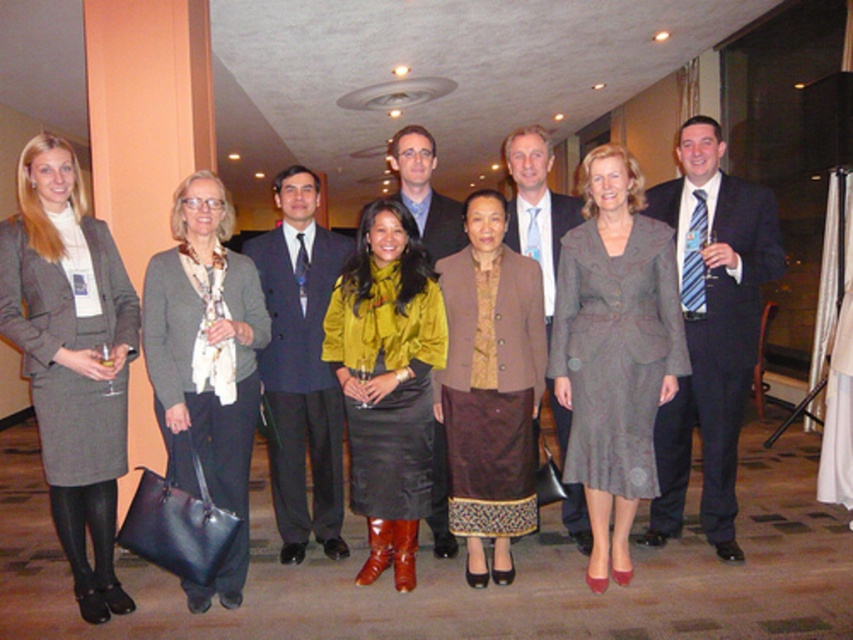
Question: Does matte black suit at center appear on the right side of velvet mustard blouse at center?

Choices:
 (A) no
 (B) yes

Answer: (B)

Question: Which object is closer to the camera taking this photo?

Choices:
 (A) satin blue suit at center
 (B) dark blue suit at center
 (C) matte gray suit at center
 (D) matte blue suit at center

Answer: (C)

Question: Does velvet mustard blouse at center lie behind dark blue suit at center?

Choices:
 (A) no
 (B) yes

Answer: (A)

Question: Which object appears farthest from the camera in this image?

Choices:
 (A) matte gray skirt at left
 (B) dark blue suit at center
 (C) matte blue suit at center
 (D) satin blue suit at center

Answer: (B)

Question: Which object is positioned farthest from the matte blue suit at center?

Choices:
 (A) matte black suit at center
 (B) dark blue suit at center

Answer: (B)

Question: Does matte gray suit at center lie behind satin blue suit at center?

Choices:
 (A) yes
 (B) no

Answer: (B)